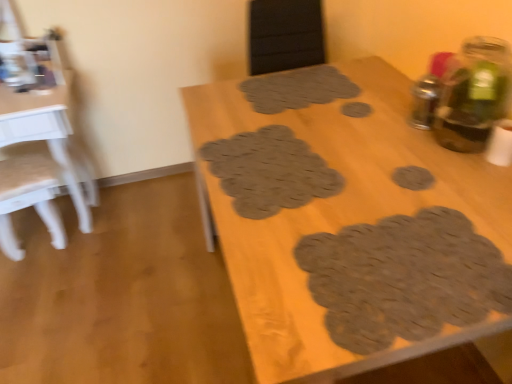
I want to click on free region on the left part of green glass bottle at upper right, the 2th bottle from the back, so click(x=402, y=149).